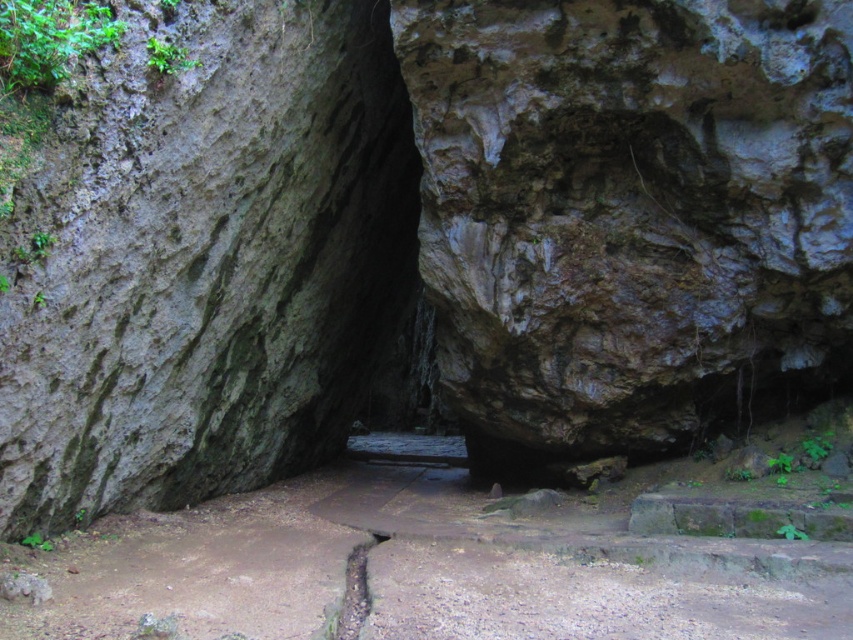
Question: Which of the following is the farthest from the observer?

Choices:
 (A) brown rough rock at center
 (B) brown dirt path at center

Answer: (A)

Question: Does brown rough rock at center have a greater width compared to brown dirt path at center?

Choices:
 (A) no
 (B) yes

Answer: (A)

Question: Can you confirm if brown rough rock at center is positioned to the right of brown dirt path at center?

Choices:
 (A) yes
 (B) no

Answer: (A)

Question: Which point appears farthest from the camera in this image?

Choices:
 (A) (648, 285)
 (B) (566, 573)

Answer: (A)

Question: Is brown rough rock at center closer to camera compared to brown dirt path at center?

Choices:
 (A) no
 (B) yes

Answer: (A)